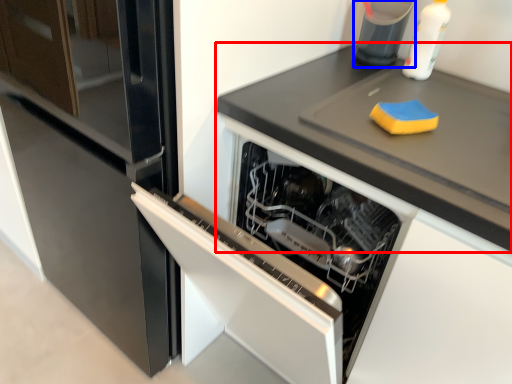
Question: Which of the following is the farthest to the observer, countertop (highlighted by a red box) or appliance (highlighted by a blue box)?

Choices:
 (A) countertop
 (B) appliance

Answer: (B)